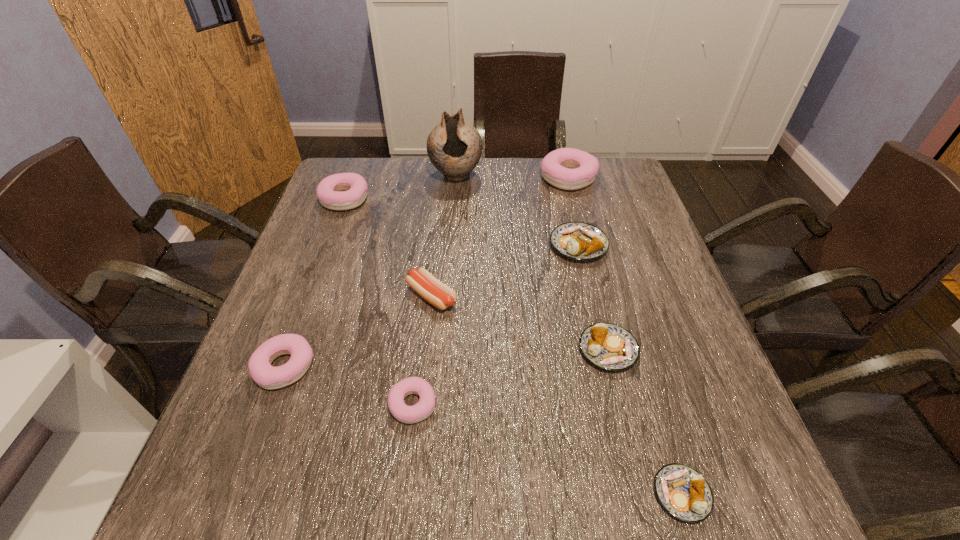
Find the location of a particular element. This screenshot has width=960, height=540. vacant region located 0.070m on the right of the second nearest brown pastry is located at coordinates (671, 350).

Locate an element on the screen. vacant area located 0.100m on the right of the second pink pastry from right to left is located at coordinates (490, 404).

Where is `blank space located 0.080m on the left of the nearest pastry`? Image resolution: width=960 pixels, height=540 pixels. blank space located 0.080m on the left of the nearest pastry is located at coordinates (604, 494).

The image size is (960, 540). I want to click on pottery situated at the far edge, so click(x=454, y=146).

At what (x,y) coordinates should I click in order to perform the action: click on object located at the near edge. Please return your answer as a coordinate pair (x, y). Looking at the image, I should click on (684, 493).

You are a GUI agent. You are given a task and a screenshot of the screen. Output one action in this format:
    pyautogui.click(x=<x>, y=<y>)
    Task: Click on the object that is at the far left corner
    The image size is (960, 540).
    Given the screenshot: What is the action you would take?
    pyautogui.click(x=353, y=187)

What are the coordinates of `object situated at the far right corner` in the screenshot? It's located at (566, 168).

Locate an element on the screen. Image resolution: width=960 pixels, height=540 pixels. object located at the near right corner is located at coordinates (684, 493).

In the image, there is a desktop. At what (x,y) coordinates should I click in order to perform the action: click on free space at the far edge. Please return your answer as a coordinate pair (x, y). The image size is (960, 540). Looking at the image, I should click on (422, 183).

The image size is (960, 540). In the image, there is a desktop. In order to click on vacant region at the near edge in this screenshot , I will do `click(455, 505)`.